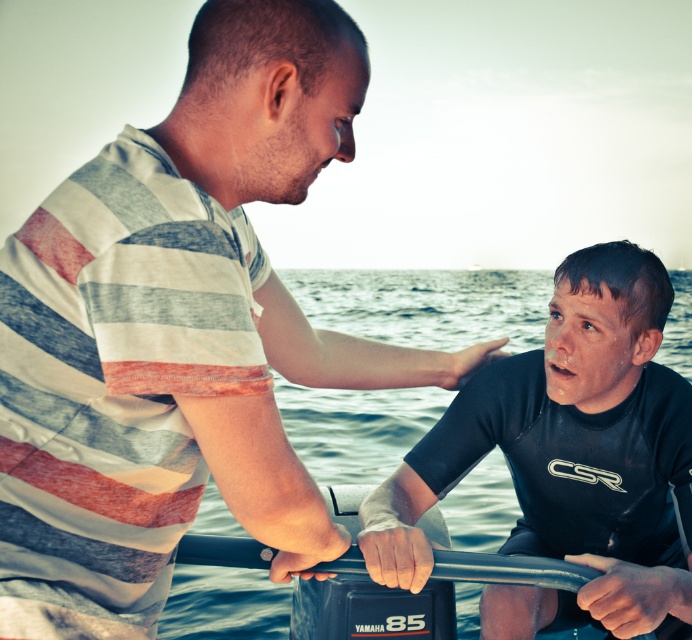
You are a photographer trying to capture the striped cotton shirt at upper left in the center of your camera frame. Given the shirt is at point 0.520, 0.257, would you need to move the camera up or down to center it?

The striped cotton shirt at upper left is positioned at coordinates (176,332). To center it in the frame, you would need to move the camera down slightly since the shirt is already near the upper part of the image.

You are an observer standing on the dock looking at the striped cotton shirt at upper left and the clear blue water at lower center. Which object has a smaller width?

The striped cotton shirt at upper left has a smaller width than the clear blue water at lower center.

Looking at this image, you are a swimmer who wants to avoid getting your black matte wetsuit at center wet. Based on the scene, is there a way to keep it dry while staying near the clear blue water at lower center?

The black matte wetsuit at center is positioned under clear blue water at lower center, so it is already submerged. To keep it dry, you would need to move it away from the water or ensure it remains above the surface.